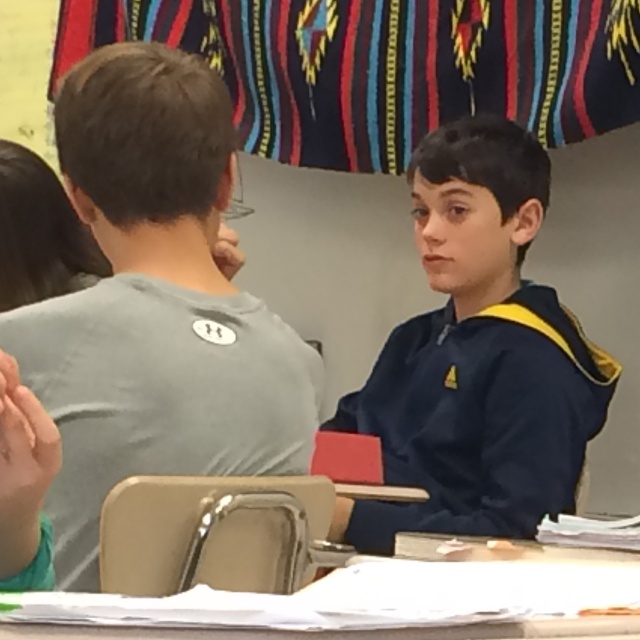
Question: Is navy blue hoodie at center to the left of white plastic table at lower center from the viewer's perspective?

Choices:
 (A) no
 (B) yes

Answer: (A)

Question: Among these points, which one is farthest from the camera?

Choices:
 (A) (60, 621)
 (B) (392, 428)

Answer: (B)

Question: Which point is farther from the camera taking this photo?

Choices:
 (A) (422, 339)
 (B) (468, 579)

Answer: (A)

Question: Is navy blue hoodie at center above white plastic table at lower center?

Choices:
 (A) no
 (B) yes

Answer: (B)

Question: Is navy blue hoodie at center further to camera compared to white plastic table at lower center?

Choices:
 (A) yes
 (B) no

Answer: (A)